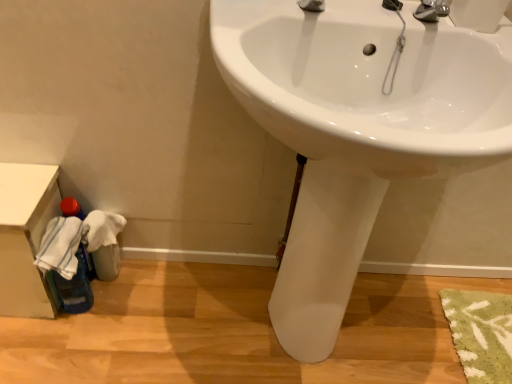
Identify the location of white glossy sink at center. (357, 129).

Describe the element at coordinates (357, 129) in the screenshot. I see `white glossy sink at center` at that location.

The width and height of the screenshot is (512, 384). In order to click on white plastic bin at lower left in this screenshot , I will do `click(25, 238)`.

Describe the element at coordinates (25, 238) in the screenshot. I see `white plastic bin at lower left` at that location.

Measure the distance between white plastic bin at lower left and camera.

white plastic bin at lower left is 35.47 inches from camera.

Where is `white glossy sink at center`? Image resolution: width=512 pixels, height=384 pixels. white glossy sink at center is located at coordinates (357, 129).

Does white glossy sink at center appear on the right side of white plastic bin at lower left?

Yes.

Does white glossy sink at center lie behind white plastic bin at lower left?

That is False.

Does point (445, 50) lie behind point (28, 266)?

No, it is in front of (28, 266).

From the image's perspective, between white glossy sink at center and white plastic bin at lower left, who is located below?

white plastic bin at lower left appears lower in the image.

From a real-world perspective, which is physically below, white glossy sink at center or white plastic bin at lower left?

white plastic bin at lower left is physically lower.

Between white glossy sink at center and white plastic bin at lower left, which one has larger width?

white glossy sink at center is wider.

Which of these two, white glossy sink at center or white plastic bin at lower left, stands shorter?

With less height is white plastic bin at lower left.

Can you confirm if white glossy sink at center is smaller than white plastic bin at lower left?

No, white glossy sink at center is not smaller than white plastic bin at lower left.

Is white plastic bin at lower left a part of white glossy sink at center?

No, white glossy sink at center does not contain white plastic bin at lower left.

Is white glossy sink at center next to white plastic bin at lower left and touching it?

No, white glossy sink at center is not beside white plastic bin at lower left.

Is white glossy sink at center looking in the opposite direction of white plastic bin at lower left?

No, white plastic bin at lower left is not at the back of white glossy sink at center.

In the scene shown: What's the angular difference between white glossy sink at center and white plastic bin at lower left's facing directions?

1.24 degrees separate the facing orientations of white glossy sink at center and white plastic bin at lower left.

The width and height of the screenshot is (512, 384). I want to click on counter top that appears behind the white glossy sink at center, so click(x=25, y=238).

Based on the photo, visually, is white plastic bin at lower left positioned to the left or to the right of white glossy sink at center?

Clearly, white plastic bin at lower left is on the left of white glossy sink at center in the image.

Which object is closer to the camera, white plastic bin at lower left or white glossy sink at center?

white glossy sink at center is more forward.

Between point (32, 268) and point (478, 121), which one is positioned in front?

The point (478, 121) is closer to the camera.

From the image's perspective, which one is positioned lower, white plastic bin at lower left or white glossy sink at center?

white plastic bin at lower left.

From a real-world perspective, is white plastic bin at lower left under white glossy sink at center?

Yes, from a real-world perspective, white plastic bin at lower left is below white glossy sink at center.

Which of these two, white plastic bin at lower left or white glossy sink at center, is thinner?

white plastic bin at lower left is thinner.

Considering the sizes of objects white plastic bin at lower left and white glossy sink at center in the image provided, who is shorter, white plastic bin at lower left or white glossy sink at center?

white plastic bin at lower left is shorter.

Which of these two, white plastic bin at lower left or white glossy sink at center, is smaller?

Smaller between the two is white plastic bin at lower left.

Would you say white glossy sink at center is part of white plastic bin at lower left's contents?

No, white glossy sink at center is not a part of white plastic bin at lower left.

Can you see white plastic bin at lower left touching white glossy sink at center?

white plastic bin at lower left and white glossy sink at center are not in contact.

Is white plastic bin at lower left positioned with its back to white glossy sink at center?

white plastic bin at lower left is not turned away from white glossy sink at center.

What's the angular difference between white plastic bin at lower left and white glossy sink at center's facing directions?

1.24 degrees.

This screenshot has height=384, width=512. In order to click on sink on the right side of white plastic bin at lower left in this screenshot , I will do `click(357, 129)`.

I want to click on counter top on the left of the white glossy sink at center, so click(x=25, y=238).

Find the location of `sink on the right of white plastic bin at lower left`. sink on the right of white plastic bin at lower left is located at coordinates (357, 129).